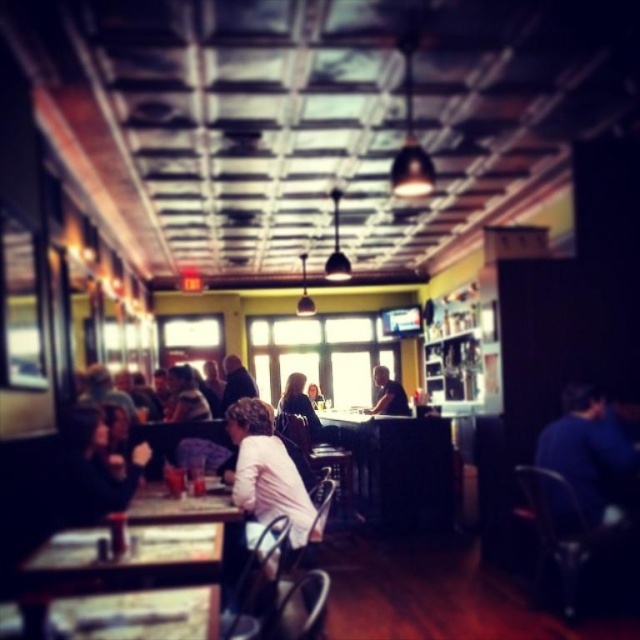
Is dark brown leather jacket at lower left in front of dark blue shirt at center?

Yes, it is in front of dark blue shirt at center.

Between dark brown leather jacket at lower left and dark blue shirt at center, which one has more height?

dark brown leather jacket at lower left

Where is `dark brown leather jacket at lower left`? dark brown leather jacket at lower left is located at coordinates (92, 468).

Can you confirm if white matte shirt at center is positioned above wooden table at center?

Yes, white matte shirt at center is above wooden table at center.

Does white matte shirt at center have a lesser width compared to wooden table at center?

Yes.

Between point (272, 442) and point (140, 502), which one is positioned in front?

Positioned in front is point (140, 502).

Image resolution: width=640 pixels, height=640 pixels. What are the coordinates of `white matte shirt at center` in the screenshot? It's located at (268, 474).

Which is behind, point (253, 518) or point (234, 378)?

Positioned behind is point (234, 378).

Does white matte shirt at center appear on the right side of dark blue shirt at center?

Correct, you'll find white matte shirt at center to the right of dark blue shirt at center.

Who is more distant from viewer, (282,461) or (225,401)?

The point (225,401) is more distant.

At what (x,y) coordinates should I click in order to perform the action: click on white matte shirt at center. Please return your answer as a coordinate pair (x, y). This screenshot has height=640, width=640. Looking at the image, I should click on (268, 474).